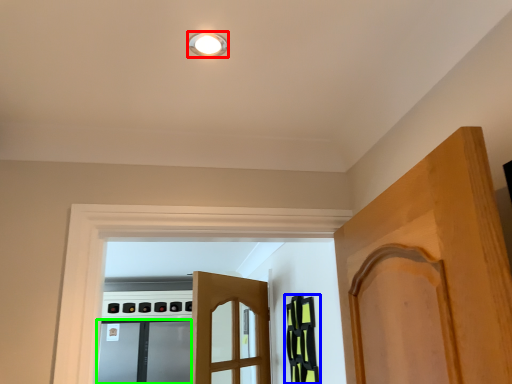
Question: Considering the real-world distances, which object is farthest from light fixture (highlighted by a red box)? cabinetry (highlighted by a blue box) or screen door (highlighted by a green box)?

Choices:
 (A) cabinetry
 (B) screen door

Answer: (B)